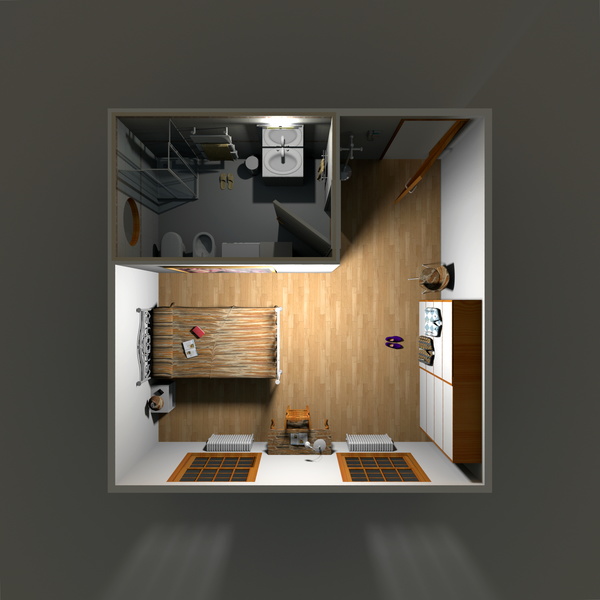
The image size is (600, 600). Find the location of `toilet`. toilet is located at coordinates (214, 239), (180, 247), (198, 245).